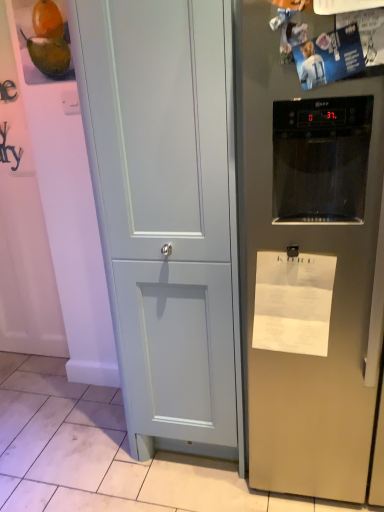
Question: From their relative heights in the image, would you say matte light blue cabinet at center is taller or shorter than white paper at right?

Choices:
 (A) tall
 (B) short

Answer: (A)

Question: From the image's perspective, is matte light blue cabinet at center positioned above or below white paper at right?

Choices:
 (A) below
 (B) above

Answer: (B)

Question: Which object is the farthest from the white paper at right?

Choices:
 (A) matte light blue cabinet at center
 (B) satin silver refrigerator at right

Answer: (A)

Question: Which is nearer to the matte light blue cabinet at center?

Choices:
 (A) satin silver refrigerator at right
 (B) white paper at right

Answer: (A)